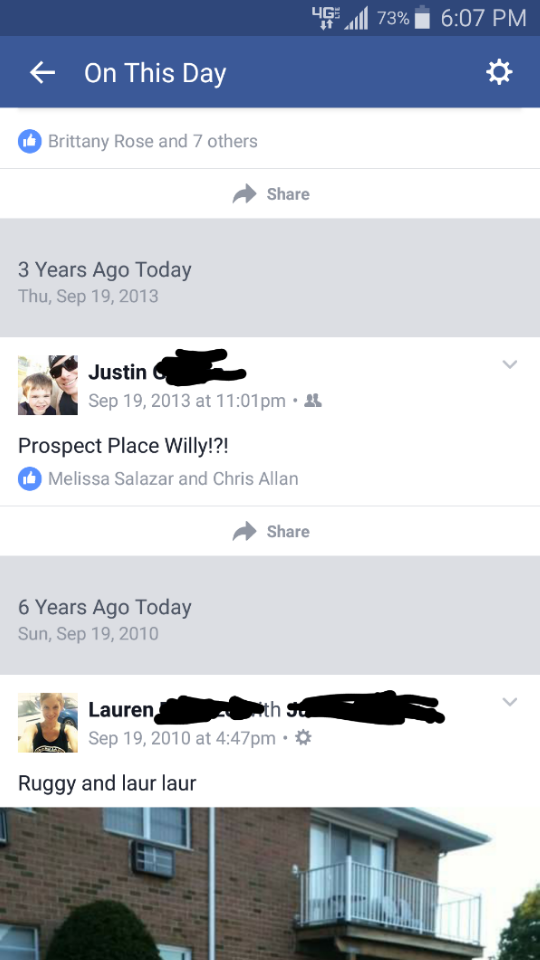
At what (x,y) coordinates should I click in order to perform the action: click on windows. Please return your answer as a coordinate pair (x, y). Looking at the image, I should click on (123, 818), (178, 813), (21, 936), (177, 949).